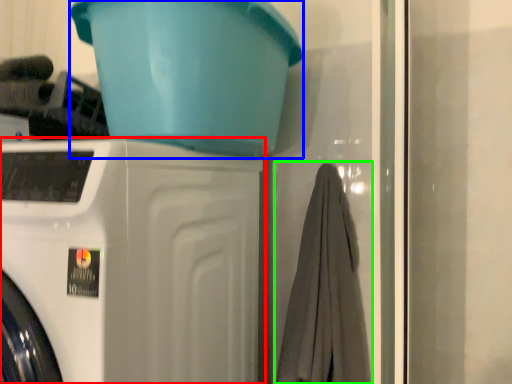
Question: Considering the real-world distances, which object is farthest from washing machine (highlighted by a red box)? basin (highlighted by a blue box) or bath towel (highlighted by a green box)?

Choices:
 (A) basin
 (B) bath towel

Answer: (B)